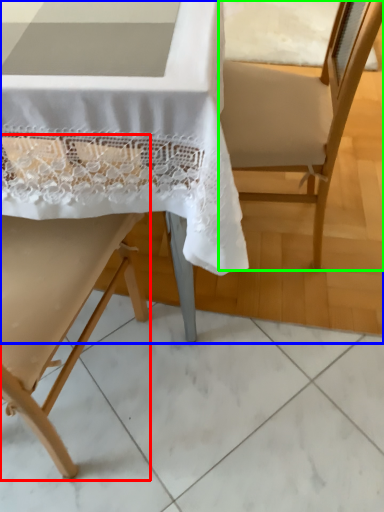
Question: Which is nearer to the chair (highlighted by a red box)? chair (highlighted by a blue box) or armchair (highlighted by a green box).

Choices:
 (A) chair
 (B) armchair

Answer: (A)